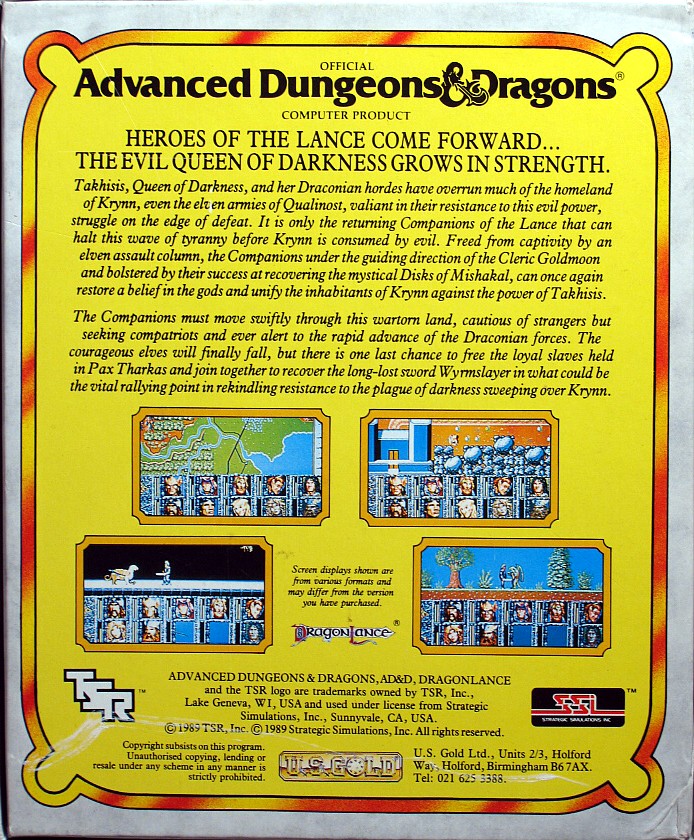
Identify the location of poster. Image resolution: width=694 pixels, height=840 pixels. (440, 28).